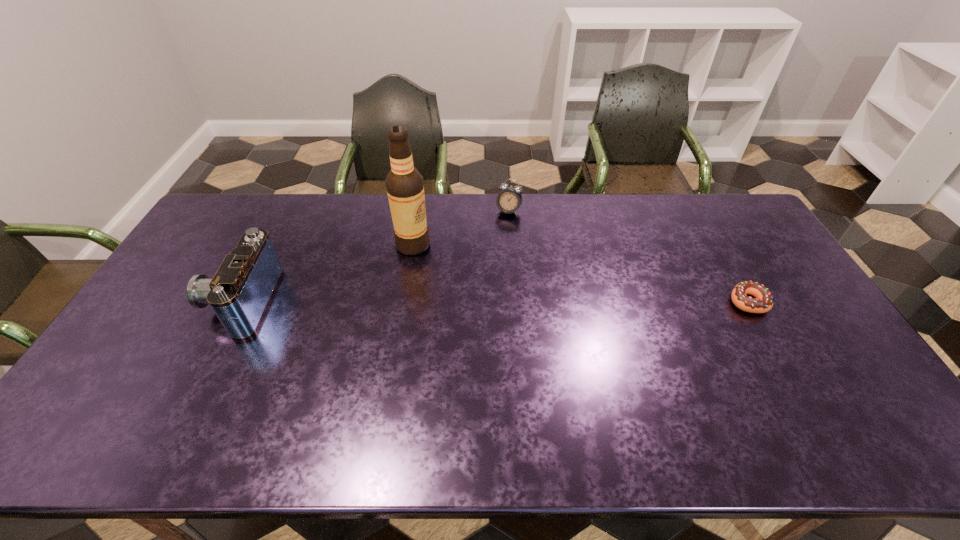
You are a GUI agent. You are given a task and a screenshot of the screen. Output one action in this format:
    pyautogui.click(x=<x>, y=<y>)
    Task: Click on the leftmost object
    
    Given the screenshot: What is the action you would take?
    pyautogui.click(x=240, y=292)

You are a GUI agent. You are given a task and a screenshot of the screen. Output one action in this format:
    pyautogui.click(x=<x>, y=<y>)
    Task: Click on the camcorder
    This screenshot has height=540, width=960.
    Given the screenshot: What is the action you would take?
    pyautogui.click(x=240, y=292)

Identify the location of the shortest object. (763, 301).

Identify the location of doughnut. This screenshot has width=960, height=540. (763, 301).

At what (x,y) coordinates should I click in order to perform the action: click on alarm clock. Please return your answer as a coordinate pair (x, y). Looking at the image, I should click on (509, 200).

Where is `the second shortest object`? the second shortest object is located at coordinates (509, 200).

Locate an element on the screen. the third object from right to left is located at coordinates (405, 188).

The width and height of the screenshot is (960, 540). In order to click on alcohol in this screenshot , I will do tap(405, 188).

Identify the location of blank area located on the back of the doughnut. This screenshot has width=960, height=540. tap(702, 221).

The height and width of the screenshot is (540, 960). I want to click on vacant space located on the face of the farthest object, so click(x=489, y=253).